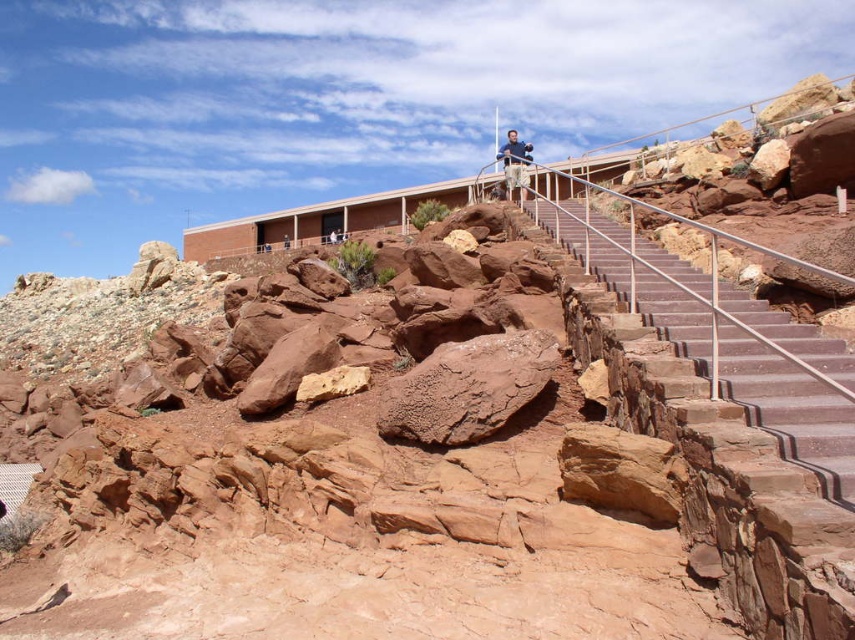
You are standing at the bottom of the smooth concrete stairs at center and want to reach the tan fabric shirt at upper center. Which direction should you move to get closer to the shirt?

To reach the tan fabric shirt at upper center from the smooth concrete stairs at center, you should move to the right since the stairs are to the left of the shirt.

You are a hiker standing at the base of the staircase leading up to the building in the rugged, rocky landscape. You want to reach the building. The point at coordinates point [594,240] is a marker indicating the halfway point of the staircase. If you start walking towards the building from your current position, how far will you have to walk to reach the halfway point?

The point at coordinates point [594,240] is 71.33 meters away from the viewer, so you will have to walk 71.33 meters to reach the halfway point of the staircase.

You are standing at the bottom of the staircase and want to place a flag exactly at the rusty rock at center. According to the coordinates provided, where should you aim to place the flag?

You should aim to place the flag at point (467,387) where the rusty rock at center is located.